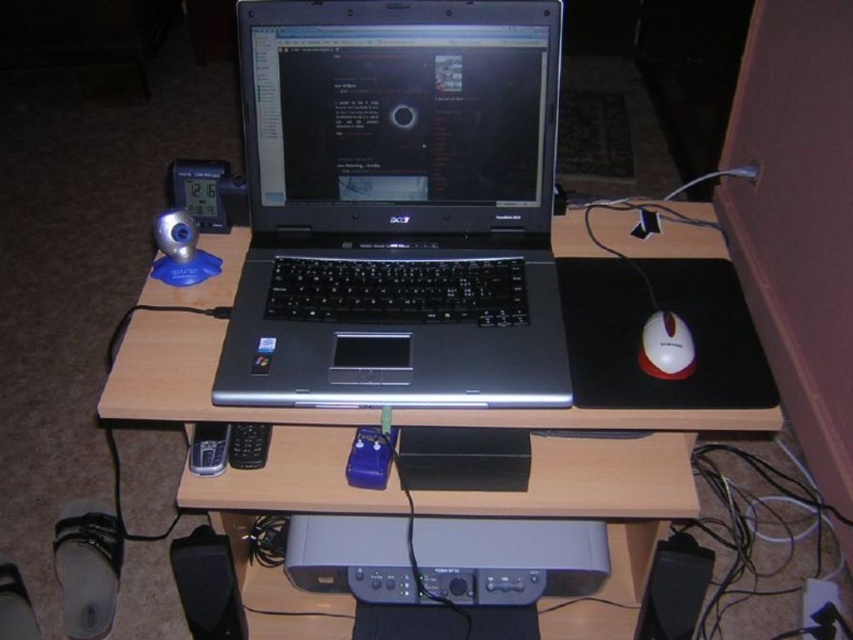
You are a GUI agent. You are given a task and a screenshot of the screen. Output one action in this format:
    pyautogui.click(x=<x>, y=<y>)
    Task: Click on the satin silver laptop at center
    This screenshot has height=640, width=853.
    Given the screenshot: What is the action you would take?
    (612, 410)

Who is more distant from viewer, (300, 451) or (184, 545)?

The point (300, 451) is more distant.

The image size is (853, 640). I want to click on satin silver laptop at center, so click(x=612, y=410).

Locate an element on the screen. The width and height of the screenshot is (853, 640). satin silver laptop at center is located at coordinates (612, 410).

Is point (322, 243) positioned after point (665, 552)?

Yes, it is.

Consider the image. Is satin black laptop at center further to the viewer compared to black plastic speaker at lower right?

No.

Between point (438, 230) and point (659, 616), which one is positioned in front?

Point (438, 230) is in front.

Where is `satin black laptop at center`? satin black laptop at center is located at coordinates (397, 205).

Locate an element on the screen. black plastic speaker at lower right is located at coordinates point(675,588).

The image size is (853, 640). I want to click on black plastic speaker at lower right, so click(x=675, y=588).